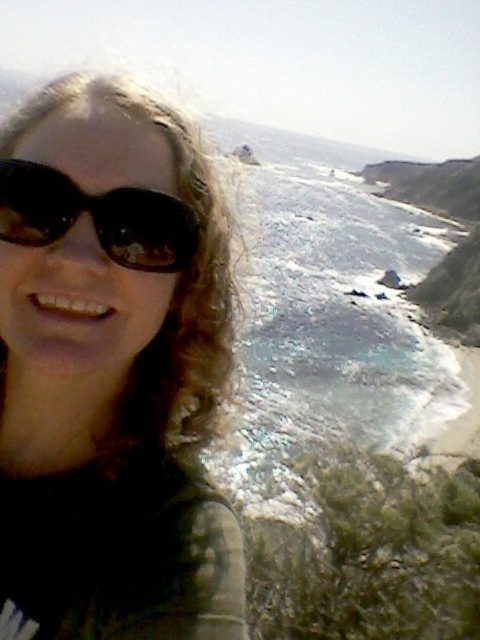
Question: Is matte black sunglasses at upper left closer to camera compared to black matte sunglasses at upper left?

Choices:
 (A) yes
 (B) no

Answer: (A)

Question: Can you confirm if matte black sunglasses at upper left is thinner than black matte sunglasses at upper left?

Choices:
 (A) yes
 (B) no

Answer: (B)

Question: Which of the following is the farthest from the observer?

Choices:
 (A) (135, 636)
 (B) (58, 195)

Answer: (B)

Question: Among these points, which one is farthest from the camera?

Choices:
 (A) (36, 317)
 (B) (157, 192)

Answer: (B)

Question: Does matte black sunglasses at upper left come in front of black matte sunglasses at upper left?

Choices:
 (A) yes
 (B) no

Answer: (A)